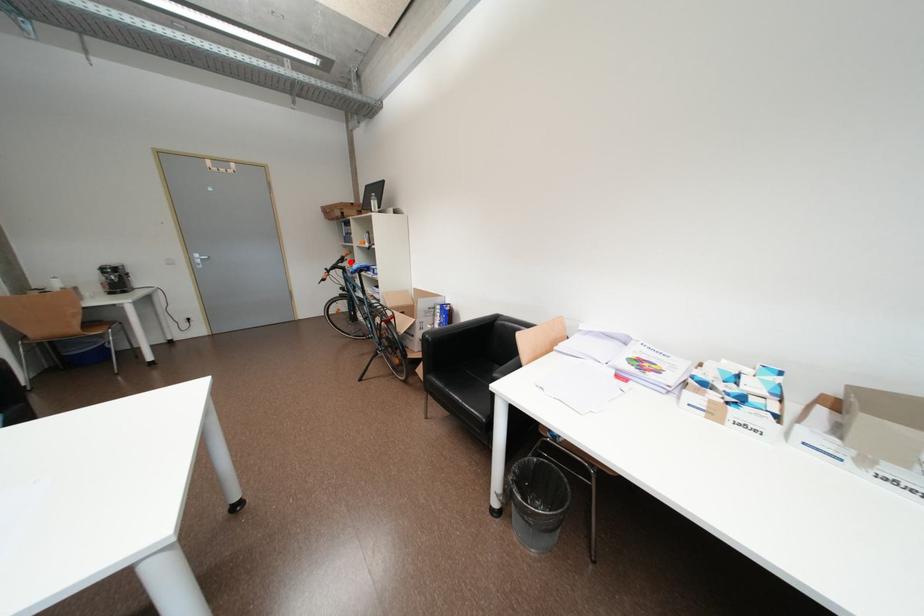
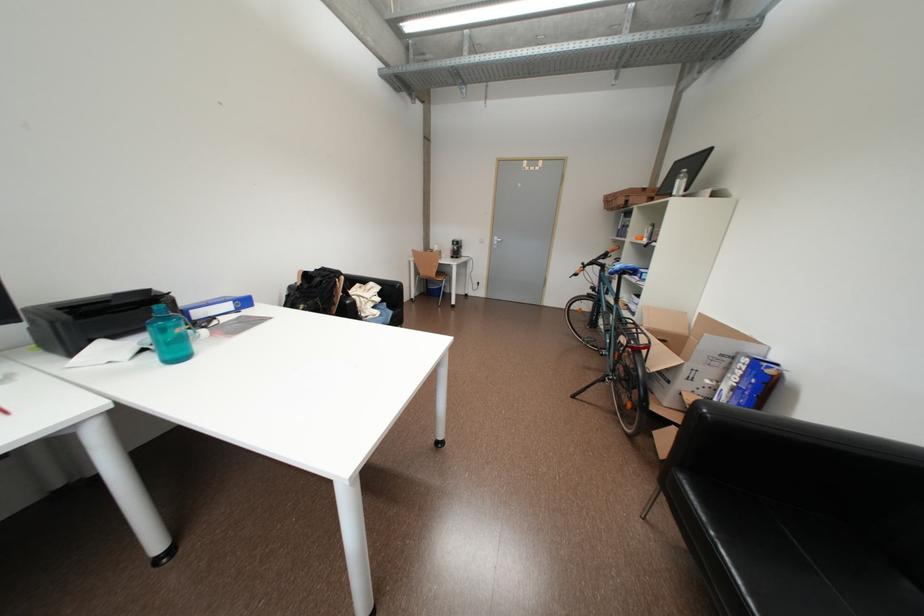
In the second image, find the point that corresponds to the highlighted location in the first image.

(613, 257)